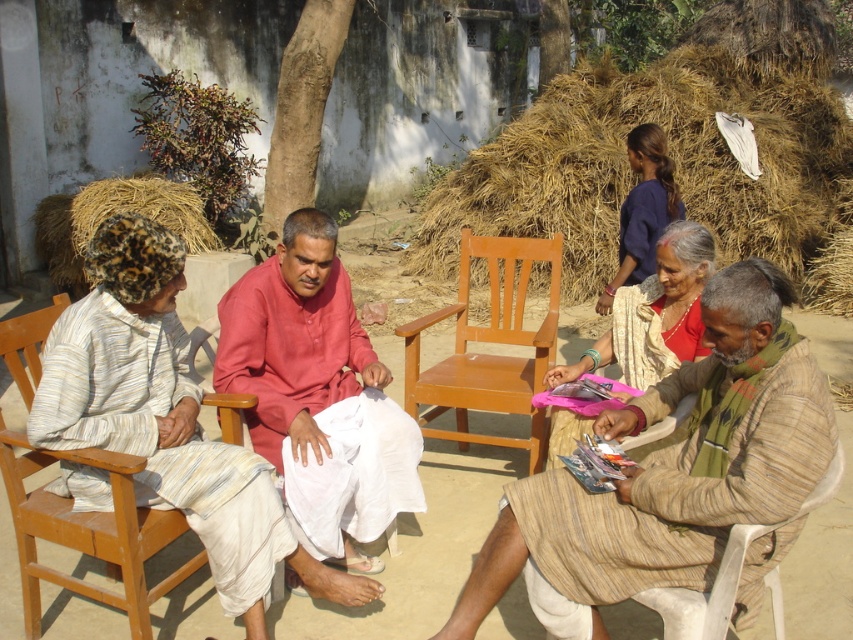
Which is behind, point (583, 120) or point (24, 570)?

Point (583, 120)

Between brown straw at upper right and wooden chair at left, which one has more height?

brown straw at upper right is taller.

Does point (511, 225) come behind point (137, 458)?

Yes, point (511, 225) is behind point (137, 458).

You are a GUI agent. You are given a task and a screenshot of the screen. Output one action in this format:
    pyautogui.click(x=<x>, y=<y>)
    Task: Click on the brown straw at upper right
    This screenshot has width=853, height=640.
    Given the screenshot: What is the action you would take?
    pyautogui.click(x=631, y=176)

Which is above, silky beige saree at center or blue fabric saree at upper right?

Positioned higher is blue fabric saree at upper right.

Can you confirm if silky beige saree at center is shorter than blue fabric saree at upper right?

In fact, silky beige saree at center may be taller than blue fabric saree at upper right.

Between point (693, 358) and point (639, 262), which one is positioned behind?

The point (639, 262) is more distant.

The width and height of the screenshot is (853, 640). I want to click on silky beige saree at center, so click(x=654, y=314).

Does matte pink kurta at center have a greater height compared to blue fabric saree at upper right?

Correct, matte pink kurta at center is much taller as blue fabric saree at upper right.

Is matte pink kurta at center above blue fabric saree at upper right?

Incorrect, matte pink kurta at center is not positioned above blue fabric saree at upper right.

Is point (299, 342) in front of point (624, 208)?

Yes, point (299, 342) is closer to viewer.

Find the location of a particular element. The width and height of the screenshot is (853, 640). matte pink kurta at center is located at coordinates (309, 356).